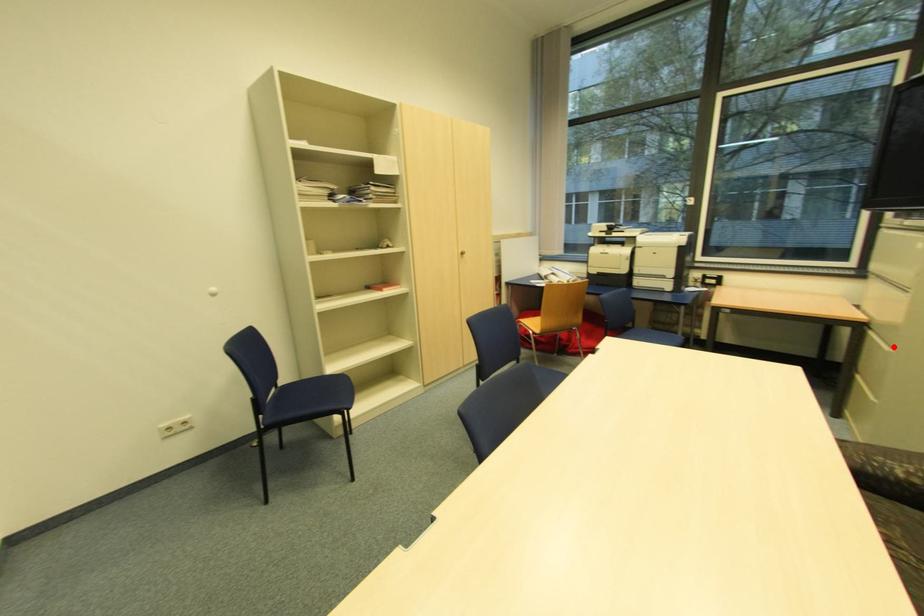
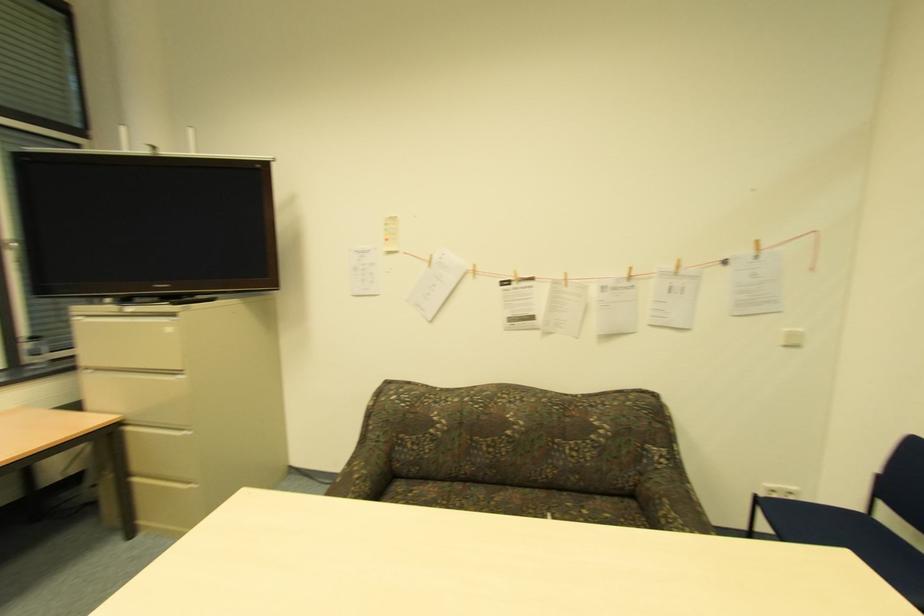
Where in the second image is the point corresponding to the highlighted location from the first image?

(187, 429)